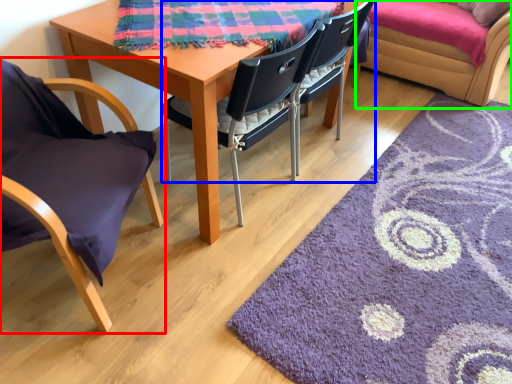
Question: Estimate the real-world distances between objects in this image. Which object is closer to chair (highlighted by a red box), chair (highlighted by a blue box) or couch (highlighted by a green box)?

Choices:
 (A) chair
 (B) couch

Answer: (A)